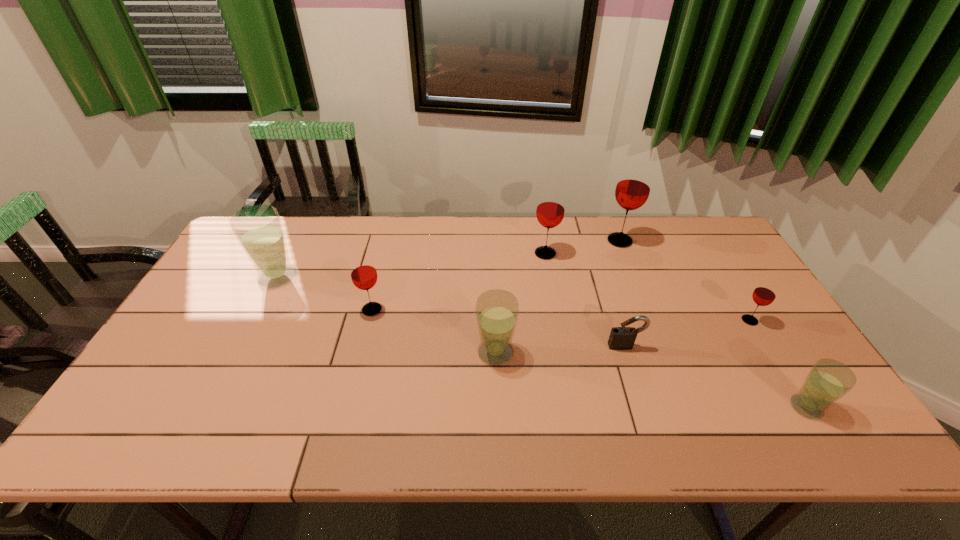
In order to click on the smallest red glass in this screenshot , I will do `click(764, 294)`.

Identify the location of the nearest blue glass. (828, 380).

The height and width of the screenshot is (540, 960). What are the coordinates of `the nearest glass` in the screenshot? It's located at (828, 380).

The width and height of the screenshot is (960, 540). In order to click on padlock in this screenshot , I will do `click(621, 338)`.

The height and width of the screenshot is (540, 960). What are the coordinates of `vacant region located on the left of the biggest red glass` in the screenshot? It's located at (505, 241).

What are the coordinates of `free space located on the right of the second biggest red glass` in the screenshot? It's located at (655, 254).

You are a GUI agent. You are given a task and a screenshot of the screen. Output one action in this format:
    pyautogui.click(x=<x>, y=<y>)
    Task: Click on the vacant area situated on the back of the leftmost object
    
    Given the screenshot: What is the action you would take?
    pyautogui.click(x=303, y=227)

Where is `vacant space located 0.320m on the right of the third biggest red glass`? vacant space located 0.320m on the right of the third biggest red glass is located at coordinates (x=495, y=310).

The width and height of the screenshot is (960, 540). In order to click on free spot located 0.380m on the right of the third object from left to right in this screenshot , I will do `click(661, 352)`.

You are a GUI agent. You are given a task and a screenshot of the screen. Output one action in this format:
    pyautogui.click(x=<x>, y=<y>)
    Task: Click on the vacant point located 0.110m on the left of the smallest red glass
    The image size is (960, 540).
    Given the screenshot: What is the action you would take?
    (701, 320)